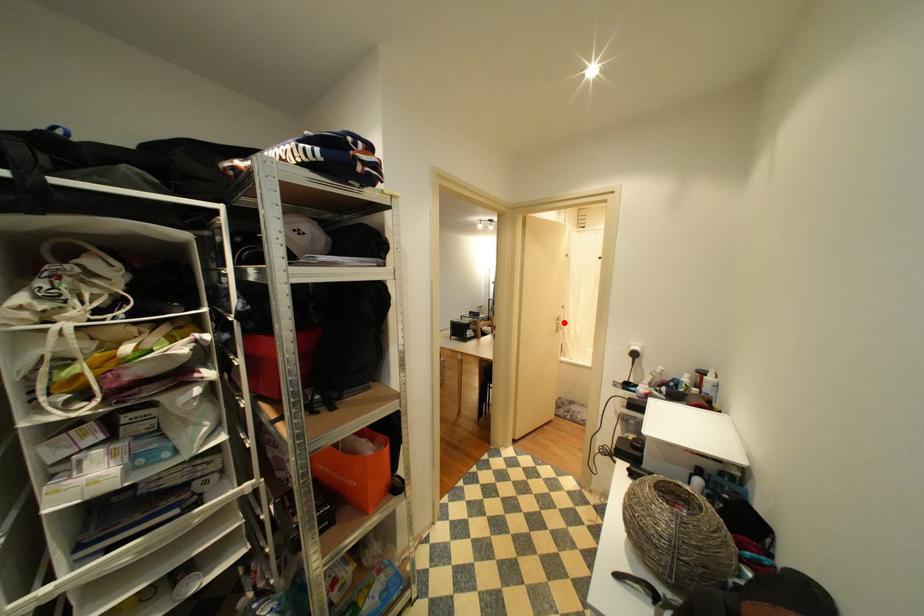
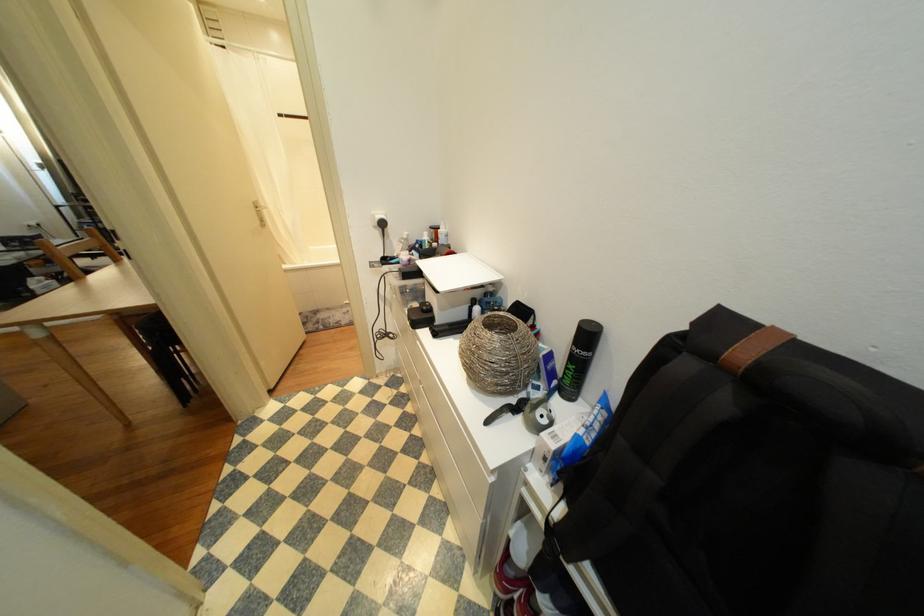
Find the pixel in the second image that matches the highlighted location in the first image.

(262, 211)